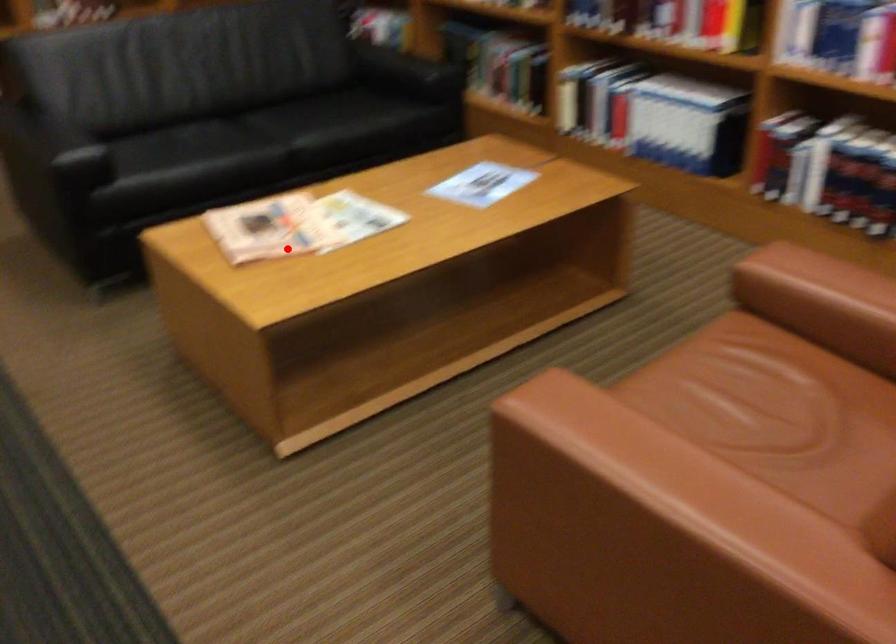
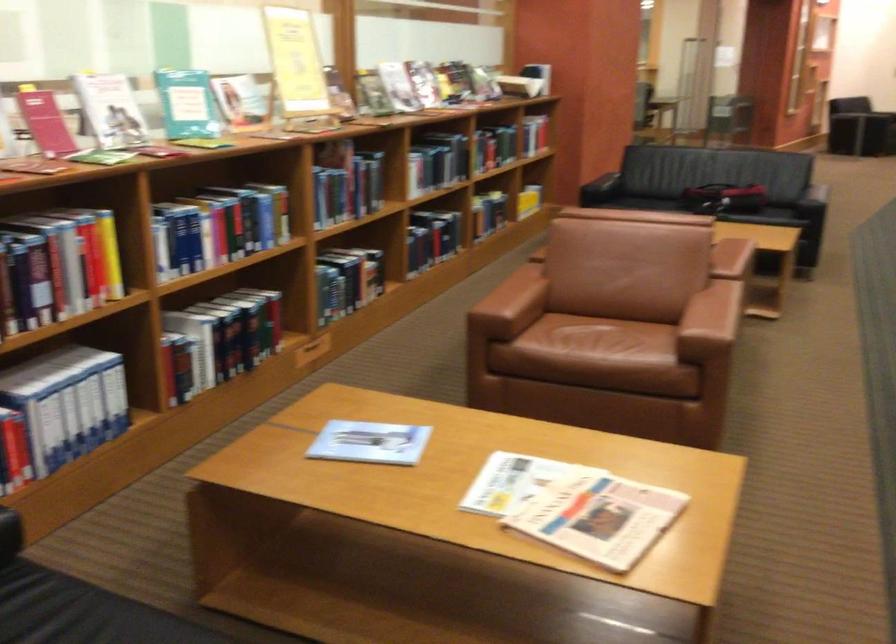
Question: I am providing you with two images of the same scene from different viewpoints. In image1, a red point is highlighted. Considering the same 3D point in image2, which of the following is correct?

Choices:
 (A) It is closer
 (B) It is farther

Answer: (A)